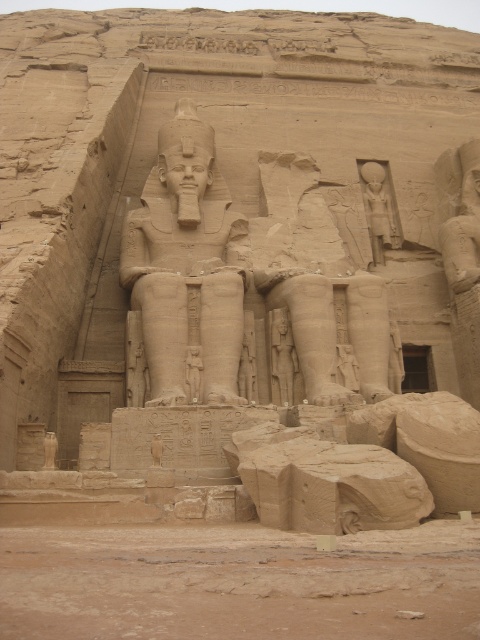
You are an archaeologist examining the monumental ancient Egyptian sculpture. You notice a point labeled as point (379, 209). Based on the coordinates, where is this point located on the sculpture?

Point (379, 209) marks the smooth stone statue at upper right.

You are an archaeologist examining the ancient Egyptian cliff carvings. You notice two statues in the scene. Based on their positions and sizes, which one is more likely to have been carved first, the sandstone statue at center or the smooth stone statue at upper right?

The sandstone statue at center is taller than the smooth stone statue at upper right. Since larger statues often require more time and resources, it is plausible that the sandstone statue at center was carved first as part of the primary structure, while the smaller smooth stone statue at upper right might have been added later as an embellishment.